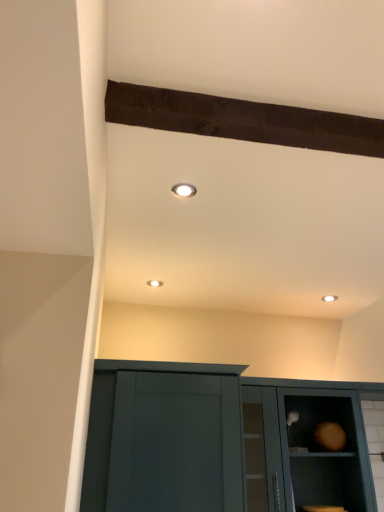
Question: From the image's perspective, relative to matte white recessed light at upper center, is matte dark green cabinet door at lower center above or below?

Choices:
 (A) below
 (B) above

Answer: (A)

Question: Is point (200, 480) positioned closer to the camera than point (188, 195)?

Choices:
 (A) closer
 (B) farther

Answer: (B)

Question: Estimate the real-world distances between objects in this image. Which object is farther from the matte dark green cabinet door at lower center?

Choices:
 (A) matte white recessed light at upper center
 (B) matte teal cabinet at lower right

Answer: (A)

Question: Which object is the closest to the matte dark green cabinet door at lower center?

Choices:
 (A) matte teal cabinet at lower right
 (B) matte white recessed light at upper center

Answer: (A)